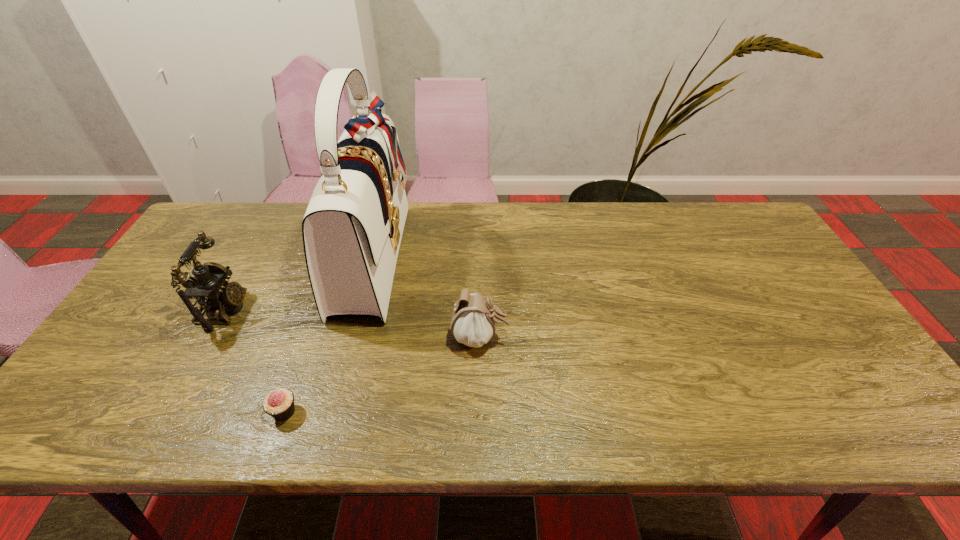
The image size is (960, 540). What are the coordinates of `vacant area that satisfies the following two spatial constraints: 1. on the rotary dial of the third shortest object; 2. on the back side of the nearest object` in the screenshot? It's located at (167, 412).